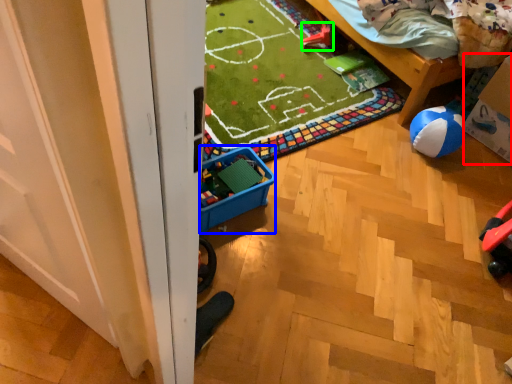
Question: Considering the real-world distances, which object is farthest from cardboard box (highlighted by a red box)? storage box (highlighted by a blue box) or toy (highlighted by a green box)?

Choices:
 (A) storage box
 (B) toy

Answer: (A)